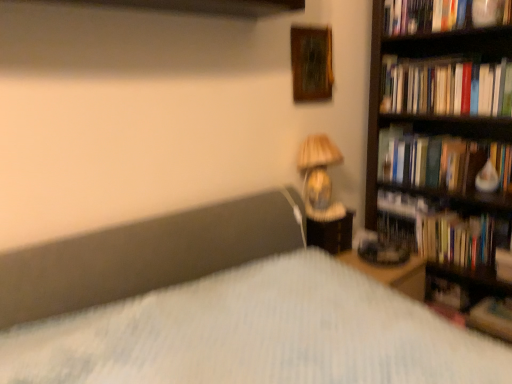
The height and width of the screenshot is (384, 512). In order to click on wooden picture frame at upper center in this screenshot , I will do coord(311,63).

Image resolution: width=512 pixels, height=384 pixels. What do you see at coordinates (492, 318) in the screenshot? I see `hardcover book at right, positioned as the 1th book in bottom-to-top order` at bounding box center [492, 318].

Image resolution: width=512 pixels, height=384 pixels. What do you see at coordinates (443, 15) in the screenshot?
I see `hardcover book at upper right, which is the fourth book from bottom to top` at bounding box center [443, 15].

Find the location of a particular element. This screenshot has height=384, width=512. matte beige lampshade at upper right is located at coordinates (319, 177).

The image size is (512, 384). Describe the element at coordinates (456, 239) in the screenshot. I see `hardcover book at right, the third book from the top` at that location.

Find the location of a particular element. Image resolution: width=512 pixels, height=384 pixels. matte plastic nightstand at right is located at coordinates (x=331, y=233).

In the scene shown: From a real-world perspective, between wooden picture frame at upper center and hardcover book at right, the third book from the top, who is vertically lower?

hardcover book at right, the third book from the top.

Where is `picture frame above the hardcover book at right, the third book from the top (from the image's perspective)`? Image resolution: width=512 pixels, height=384 pixels. picture frame above the hardcover book at right, the third book from the top (from the image's perspective) is located at coordinates (311, 63).

From the image's perspective, which is below, wooden picture frame at upper center or hardcover book at right, acting as the second book starting from the bottom?

hardcover book at right, acting as the second book starting from the bottom, from the image's perspective.

Does wooden picture frame at upper center have a lesser height compared to hardcover book at right, acting as the second book starting from the bottom?

Incorrect, the height of wooden picture frame at upper center does not fall short of that of hardcover book at right, acting as the second book starting from the bottom.

Does wooden picture frame at upper center have a lesser height compared to matte beige lampshade at upper right?

Yes.

Is wooden picture frame at upper center wider or thinner than matte beige lampshade at upper right?

Considering their sizes, wooden picture frame at upper center looks slimmer than matte beige lampshade at upper right.

From a real-world perspective, relative to matte beige lampshade at upper right, is wooden picture frame at upper center vertically above or below?

wooden picture frame at upper center is situated higher than matte beige lampshade at upper right in the real world.

Could you tell me if wooden picture frame at upper center is facing matte beige lampshade at upper right?

No, wooden picture frame at upper center does not turn towards matte beige lampshade at upper right.

Can you see hardcover book at right, which appears as the fourth book when viewed from the top, touching hardcover books at right, which is counted as the 3th book, starting from the bottom?

No, hardcover book at right, which appears as the fourth book when viewed from the top, is not in contact with hardcover books at right, which is counted as the 3th book, starting from the bottom.

Would you say hardcover book at right, positioned as the 1th book in bottom-to-top order, is outside hardcover books at right, which is counted as the 3th book, starting from the bottom?

Yes, hardcover book at right, positioned as the 1th book in bottom-to-top order, is not within hardcover books at right, which is counted as the 3th book, starting from the bottom.

The width and height of the screenshot is (512, 384). There is a hardcover books at right, the second book viewed from the top. Find the location of `the 2nd book below it (from the image's perspective)`. the 2nd book below it (from the image's perspective) is located at coordinates (492, 318).

Which is more to the left, hardcover book at right, positioned as the 1th book in bottom-to-top order, or hardcover books at right, the second book viewed from the top?

From the viewer's perspective, hardcover books at right, the second book viewed from the top, appears more on the left side.

The width and height of the screenshot is (512, 384). What are the coordinates of `nightstand located in front of the hardcover book at right, which appears as the fourth book when viewed from the top` in the screenshot? It's located at (331, 233).

Which object is positioned more to the right, hardcover book at right, which appears as the fourth book when viewed from the top, or matte plastic nightstand at right?

hardcover book at right, which appears as the fourth book when viewed from the top, is more to the right.

Looking at their sizes, would you say hardcover book at right, positioned as the 1th book in bottom-to-top order, is wider or thinner than matte plastic nightstand at right?

Considering their sizes, hardcover book at right, positioned as the 1th book in bottom-to-top order, looks broader than matte plastic nightstand at right.

Is point (479, 303) positioned before point (335, 221)?

No, it is behind (335, 221).

From a real-world perspective, is hardcover books at right, the second book viewed from the top, located beneath wooden picture frame at upper center?

Indeed, from a real-world perspective, hardcover books at right, the second book viewed from the top, is positioned beneath wooden picture frame at upper center.

Does hardcover books at right, which is counted as the 3th book, starting from the bottom, come behind wooden picture frame at upper center?

No, hardcover books at right, which is counted as the 3th book, starting from the bottom, is closer to the viewer.

Is hardcover books at right, the second book viewed from the top, bigger than wooden picture frame at upper center?

Correct, hardcover books at right, the second book viewed from the top, is larger in size than wooden picture frame at upper center.

Considering the relative sizes of matte beige lampshade at upper right and wooden picture frame at upper center in the image provided, is matte beige lampshade at upper right wider than wooden picture frame at upper center?

Indeed, matte beige lampshade at upper right has a greater width compared to wooden picture frame at upper center.

Which is more to the right, matte beige lampshade at upper right or wooden picture frame at upper center?

Positioned to the right is matte beige lampshade at upper right.

From a real-world perspective, is matte beige lampshade at upper right positioned above or below wooden picture frame at upper center?

matte beige lampshade at upper right is situated lower than wooden picture frame at upper center in the real world.

From the image's perspective, is matte beige lampshade at upper right located above wooden picture frame at upper center?

Actually, matte beige lampshade at upper right appears below wooden picture frame at upper center in the image.

Is hardcover book at upper right, the first book from the top, far from wooden picture frame at upper center?

hardcover book at upper right, the first book from the top, is actually quite close to wooden picture frame at upper center.

Considering the sizes of objects hardcover book at upper right, the first book from the top, and wooden picture frame at upper center in the image provided, who is shorter, hardcover book at upper right, the first book from the top, or wooden picture frame at upper center?

Standing shorter between the two is hardcover book at upper right, the first book from the top.

Does hardcover book at upper right, which is the fourth book from bottom to top, come behind wooden picture frame at upper center?

Yes, hardcover book at upper right, which is the fourth book from bottom to top, is further from the camera.

From the image's perspective, is hardcover book at upper right, which is the fourth book from bottom to top, located above wooden picture frame at upper center?

Yes, from the image's perspective, hardcover book at upper right, which is the fourth book from bottom to top, is over wooden picture frame at upper center.

Where is `picture frame lying on the left of hardcover book at right, acting as the second book starting from the bottom`? picture frame lying on the left of hardcover book at right, acting as the second book starting from the bottom is located at coordinates (311, 63).

Where is `picture frame located behind the matte beige lampshade at upper right`? picture frame located behind the matte beige lampshade at upper right is located at coordinates (311, 63).

Considering their positions, is wooden picture frame at upper center positioned closer to hardcover book at upper right, which is the fourth book from bottom to top, than hardcover books at right, which is counted as the 3th book, starting from the bottom?

hardcover books at right, which is counted as the 3th book, starting from the bottom, lies closer to hardcover book at upper right, which is the fourth book from bottom to top, than the other object.

When comparing their distances from hardcover book at upper right, which is the fourth book from bottom to top, does hardcover book at right or wooden picture frame at upper center seem further?

hardcover book at right.

Considering their positions, is matte plastic nightstand at right positioned closer to hardcover book at right than hardcover book at upper right, the first book from the top?

Among the two, matte plastic nightstand at right is located nearer to hardcover book at right.

Based on their spatial positions, is hardcover book at upper right, which is the fourth book from bottom to top, or hardcover book at right, acting as the second book starting from the bottom, further from hardcover book at right?

Based on the image, hardcover book at upper right, which is the fourth book from bottom to top, appears to be further to hardcover book at right.

When comparing their distances from matte plastic nightstand at right, does hardcover book at right, which appears as the fourth book when viewed from the top, or hardcover book at upper right, the first book from the top, seem closer?

Based on the image, hardcover book at right, which appears as the fourth book when viewed from the top, appears to be nearer to matte plastic nightstand at right.

Looking at the image, which one is located closer to matte beige lampshade at upper right, matte plastic nightstand at right or hardcover book at right, positioned as the 1th book in bottom-to-top order?

Among the two, matte plastic nightstand at right is located nearer to matte beige lampshade at upper right.

Considering their positions, is hardcover book at upper right, which is the fourth book from bottom to top, positioned further to hardcover book at right, positioned as the 1th book in bottom-to-top order, than hardcover books at right, the second book viewed from the top?

hardcover book at upper right, which is the fourth book from bottom to top, is positioned further to the anchor hardcover book at right, positioned as the 1th book in bottom-to-top order.

Estimate the real-world distances between objects in this image. Which object is further from hardcover books at right, the second book viewed from the top, hardcover book at upper right, the first book from the top, or matte plastic nightstand at right?

The object further to hardcover books at right, the second book viewed from the top, is matte plastic nightstand at right.

This screenshot has width=512, height=384. Identify the location of nightstand between wooden picture frame at upper center and hardcover book at right, positioned as the 1th book in bottom-to-top order, in the up-down direction. click(x=331, y=233).

I want to click on lamp between wooden picture frame at upper center and matte plastic nightstand at right in the up-down direction, so click(x=319, y=177).

This screenshot has width=512, height=384. Identify the location of lamp that lies between hardcover books at right, which is counted as the 3th book, starting from the bottom, and hardcover book at right, which appears as the fourth book when viewed from the top, from top to bottom. (319, 177).

This screenshot has height=384, width=512. Find the location of `nightstand between hardcover book at upper right, which is the fourth book from bottom to top, and hardcover book at right, which appears as the fourth book when viewed from the top, from top to bottom`. nightstand between hardcover book at upper right, which is the fourth book from bottom to top, and hardcover book at right, which appears as the fourth book when viewed from the top, from top to bottom is located at coordinates (331, 233).